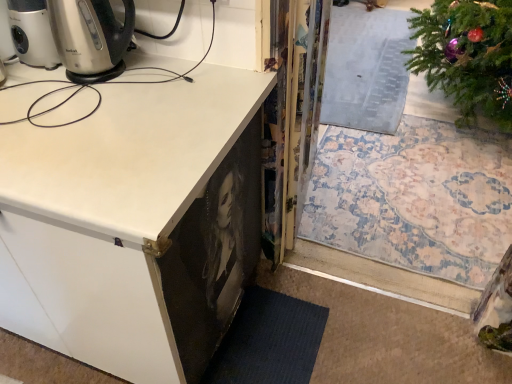
Question: Considering the positions of point (175, 173) and point (291, 107), is point (175, 173) closer or farther from the camera than point (291, 107)?

Choices:
 (A) farther
 (B) closer

Answer: (B)

Question: Based on their positions, is white matte cabinet at lower left located to the left or right of transparent plastic screen door at center?

Choices:
 (A) left
 (B) right

Answer: (A)

Question: Considering the positions of white matte cabinet at lower left and transparent plastic screen door at center in the image, is white matte cabinet at lower left taller or shorter than transparent plastic screen door at center?

Choices:
 (A) tall
 (B) short

Answer: (A)

Question: Looking at their shapes, would you say transparent plastic screen door at center is wider or thinner than white matte cabinet at lower left?

Choices:
 (A) wide
 (B) thin

Answer: (B)

Question: Would you say transparent plastic screen door at center is to the left or to the right of white matte cabinet at lower left in the picture?

Choices:
 (A) left
 (B) right

Answer: (B)

Question: Is transparent plastic screen door at center bigger or smaller than white matte cabinet at lower left?

Choices:
 (A) small
 (B) big

Answer: (A)

Question: Is transparent plastic screen door at center taller or shorter than white matte cabinet at lower left?

Choices:
 (A) short
 (B) tall

Answer: (A)